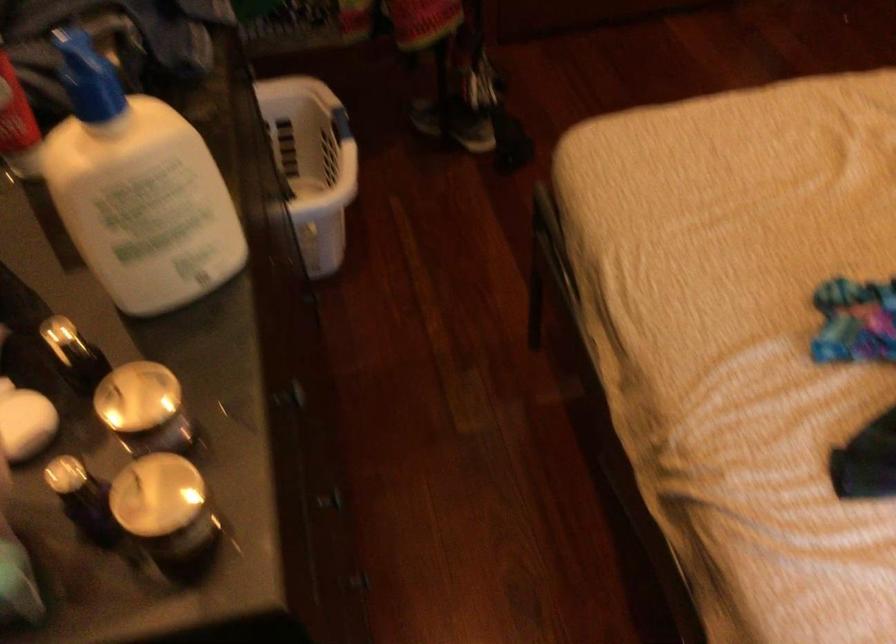
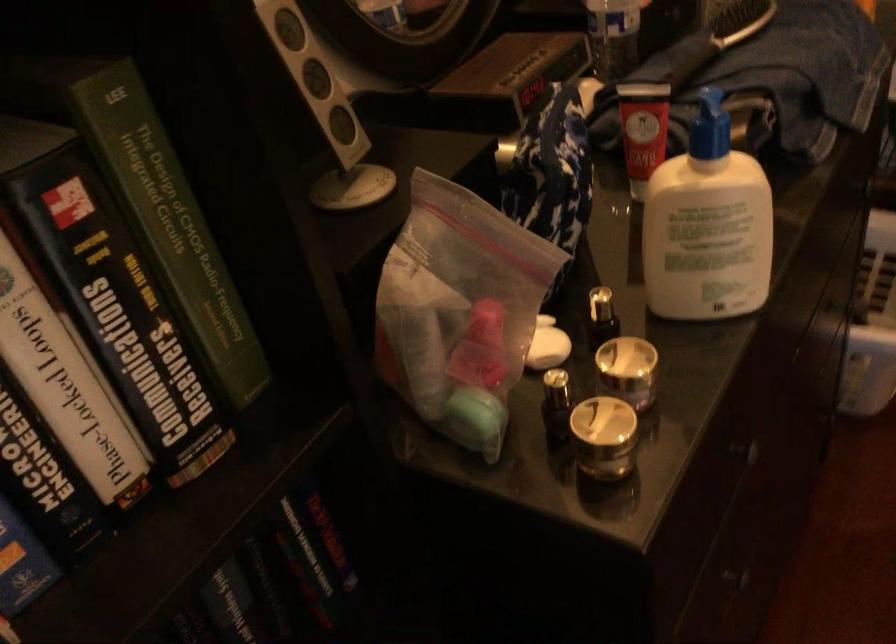
In the second image, find the point that corresponds to pixel 161 411 in the first image.

(627, 371)